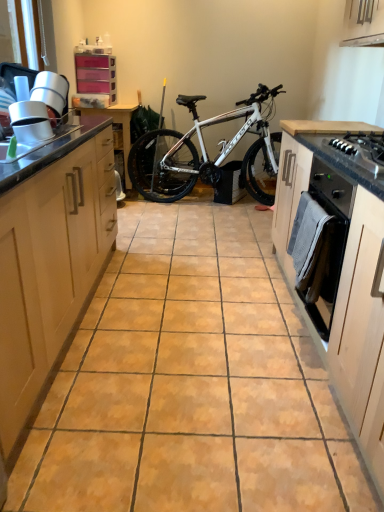
The width and height of the screenshot is (384, 512). What do you see at coordinates (122, 127) in the screenshot?
I see `wooden table at center` at bounding box center [122, 127].

This screenshot has height=512, width=384. Find the location of `black glossy gas stove at right`. black glossy gas stove at right is located at coordinates (361, 149).

In order to click on black matte oven at right in this screenshot , I will do `click(322, 242)`.

The image size is (384, 512). Describe the element at coordinates (322, 242) in the screenshot. I see `black matte oven at right` at that location.

In the scene shown: What is the approximate width of light wood oven at right, placed as the second cabinetry when sorted from left to right?

12.74 inches.

Find the location of a particular element. This screenshot has height=512, width=384. light wood cabinet at left, positioned as the 2th cabinetry in right-to-left order is located at coordinates (50, 264).

Measure the distance from light wood cabinet at left, positioned as the 2th cabinetry in right-to-left order, to black matte oven at right.

light wood cabinet at left, positioned as the 2th cabinetry in right-to-left order, is 1.08 meters away from black matte oven at right.

From the picture: Could you tell me if light wood cabinet at left, positioned as the 2th cabinetry in right-to-left order, is facing black matte oven at right?

Yes, light wood cabinet at left, positioned as the 2th cabinetry in right-to-left order, faces towards black matte oven at right.

From a real-world perspective, is light wood cabinet at left, the first cabinetry positioned from the left, over black matte oven at right?

Yes.

Considering the relative sizes of light wood cabinet at left, positioned as the 2th cabinetry in right-to-left order, and black matte oven at right in the image provided, is light wood cabinet at left, positioned as the 2th cabinetry in right-to-left order, taller than black matte oven at right?

Yes.

Is white metallic bicycle at center looking in the opposite direction of wooden table at center?

No, white metallic bicycle at center is not facing away from wooden table at center.

Considering the sizes of objects white metallic bicycle at center and wooden table at center in the image provided, who is thinner, white metallic bicycle at center or wooden table at center?

With smaller width is white metallic bicycle at center.

Considering the positions of objects white metallic bicycle at center and wooden table at center in the image provided, who is more to the left, white metallic bicycle at center or wooden table at center?

wooden table at center.

Is white metallic bicycle at center touching wooden table at center?

white metallic bicycle at center is not next to wooden table at center, and they're not touching.

Is black glossy gas stove at right surrounding black matte oven at right?

No, black glossy gas stove at right does not contain black matte oven at right.

Visually, is black glossy gas stove at right positioned to the left or to the right of black matte oven at right?

Clearly, black glossy gas stove at right is on the right of black matte oven at right in the image.

Which is farther from the camera, (342,146) or (298,270)?

Point (298,270)

Are wooden table at center and black glossy gas stove at right located far from each other?

Yes.

This screenshot has height=512, width=384. Identify the location of gas stove in front of the wooden table at center. (361, 149).

Does wooden table at center appear on the right side of black glossy gas stove at right?

In fact, wooden table at center is to the left of black glossy gas stove at right.

Which object is further away from the camera taking this photo, wooden table at center or black glossy gas stove at right?

wooden table at center is more distant.

Does light wood cabinet at left, positioned as the 2th cabinetry in right-to-left order, turn towards wooden table at center?

No, light wood cabinet at left, positioned as the 2th cabinetry in right-to-left order, does not turn towards wooden table at center.

Would you say light wood cabinet at left, positioned as the 2th cabinetry in right-to-left order, is outside wooden table at center?

Indeed, light wood cabinet at left, positioned as the 2th cabinetry in right-to-left order, is completely outside wooden table at center.

What are the coordinates of `the 1st cabinetry to the right when counting from the wooden table at center` in the screenshot? It's located at (50, 264).

Which object is closer to the camera taking this photo, light wood cabinet at left, positioned as the 2th cabinetry in right-to-left order, or light wood oven at right, which ranks as the first cabinetry in right-to-left order?

light wood oven at right, which ranks as the first cabinetry in right-to-left order, is closer to the camera.

From a real-world perspective, relative to light wood oven at right, which ranks as the first cabinetry in right-to-left order, is light wood cabinet at left, the first cabinetry positioned from the left, vertically above or below?

In terms of real-world spatial position, light wood cabinet at left, the first cabinetry positioned from the left, is above light wood oven at right, which ranks as the first cabinetry in right-to-left order.

Considering the relative sizes of light wood cabinet at left, the first cabinetry positioned from the left, and light wood oven at right, which ranks as the first cabinetry in right-to-left order, in the image provided, is light wood cabinet at left, the first cabinetry positioned from the left, bigger than light wood oven at right, which ranks as the first cabinetry in right-to-left order,?

Yes.

Can you confirm if black glossy gas stove at right is taller than light wood oven at right, placed as the second cabinetry when sorted from left to right?

No, black glossy gas stove at right is not taller than light wood oven at right, placed as the second cabinetry when sorted from left to right.

Does black glossy gas stove at right come in front of light wood oven at right, which ranks as the first cabinetry in right-to-left order?

No, the depth of black glossy gas stove at right is greater than that of light wood oven at right, which ranks as the first cabinetry in right-to-left order.

Does point (380, 151) lie behind point (383, 498)?

Yes, point (380, 151) is farther from viewer.

Does black glossy gas stove at right appear on the left side of light wood oven at right, placed as the second cabinetry when sorted from left to right?

No, black glossy gas stove at right is not to the left of light wood oven at right, placed as the second cabinetry when sorted from left to right.

I want to click on oven beneath the light wood cabinet at left, the first cabinetry positioned from the left (from a real-world perspective), so click(x=322, y=242).

The width and height of the screenshot is (384, 512). I want to click on bicycle in front of the wooden table at center, so click(x=207, y=153).

When comparing their distances from wooden table at center, does white metallic bicycle at center or black glossy gas stove at right seem further?

The object further to wooden table at center is black glossy gas stove at right.

Which object lies nearer to the anchor point light wood cabinet at left, the first cabinetry positioned from the left, black glossy gas stove at right or white metallic bicycle at center?

The object closer to light wood cabinet at left, the first cabinetry positioned from the left, is black glossy gas stove at right.

Which object lies further to the anchor point black glossy gas stove at right, black matte oven at right or light wood oven at right, placed as the second cabinetry when sorted from left to right?

light wood oven at right, placed as the second cabinetry when sorted from left to right.

Looking at the image, which one is located closer to black glossy gas stove at right, wooden table at center or light wood oven at right, placed as the second cabinetry when sorted from left to right?

Among the two, light wood oven at right, placed as the second cabinetry when sorted from left to right, is located nearer to black glossy gas stove at right.

Which object lies further to the anchor point white metallic bicycle at center, light wood oven at right, placed as the second cabinetry when sorted from left to right, or black glossy gas stove at right?

The object further to white metallic bicycle at center is light wood oven at right, placed as the second cabinetry when sorted from left to right.

Estimate the real-world distances between objects in this image. Which object is further from light wood oven at right, placed as the second cabinetry when sorted from left to right, white metallic bicycle at center or black matte oven at right?

The object further to light wood oven at right, placed as the second cabinetry when sorted from left to right, is white metallic bicycle at center.

Based on the photo, looking at the image, which one is located closer to black matte oven at right, wooden table at center or light wood cabinet at left, the first cabinetry positioned from the left?

light wood cabinet at left, the first cabinetry positioned from the left, is positioned closer to the anchor black matte oven at right.

From the image, which object appears to be farther from black glossy gas stove at right, light wood cabinet at left, the first cabinetry positioned from the left, or light wood oven at right, which ranks as the first cabinetry in right-to-left order?

light wood cabinet at left, the first cabinetry positioned from the left, is positioned further to the anchor black glossy gas stove at right.

In order to click on gas stove positioned between light wood oven at right, which ranks as the first cabinetry in right-to-left order, and white metallic bicycle at center from near to far in this screenshot , I will do `click(361, 149)`.

The width and height of the screenshot is (384, 512). I want to click on gas stove between light wood oven at right, placed as the second cabinetry when sorted from left to right, and black matte oven at right in the front-back direction, so click(361, 149).

I want to click on cabinetry between light wood oven at right, which ranks as the first cabinetry in right-to-left order, and wooden table at center from front to back, so (50, 264).

Where is `oven between black glossy gas stove at right and white metallic bicycle at center from front to back`? oven between black glossy gas stove at right and white metallic bicycle at center from front to back is located at coordinates (322, 242).